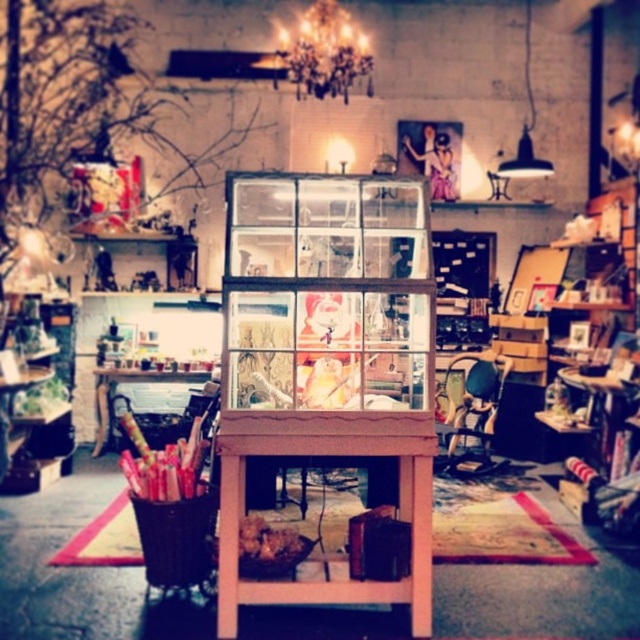
You are a customer in the store and want to place a new item on the table. You see the clear plastic cabinet at center and the pink wood table at center. Which object is closer to you?

The clear plastic cabinet at center is closer to you because the pink wood table at center is behind it.

You are organizing a space in the image and need to place a new item between the clear plastic cabinet at center and the pink wood table at center. Based on their positions, which object should the item be placed closer to?

The item should be placed closer to the pink wood table at center because the clear plastic cabinet at center is to the right of the pink wood table at center, meaning the table is to the left of the cabinet. Therefore, placing the item closer to the table would be between them.